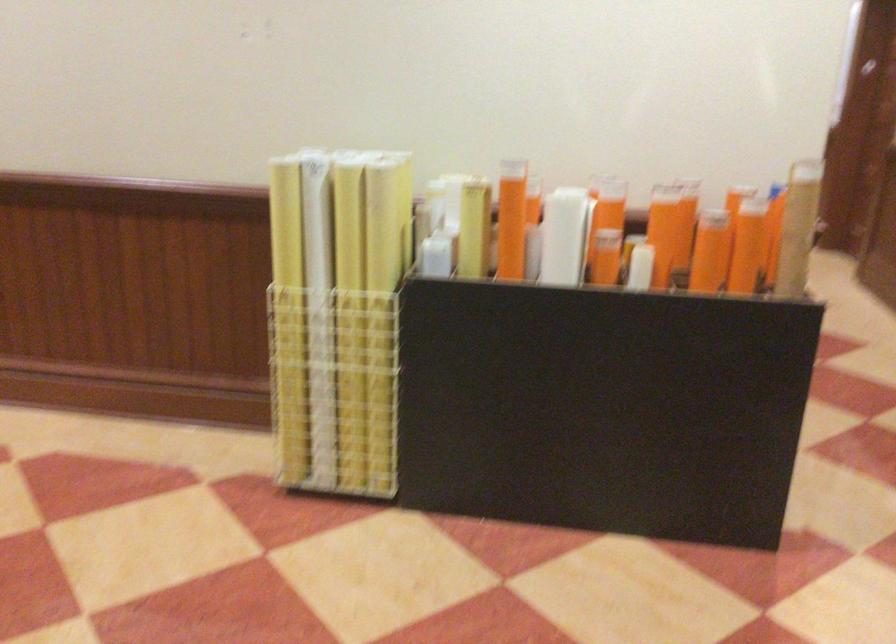
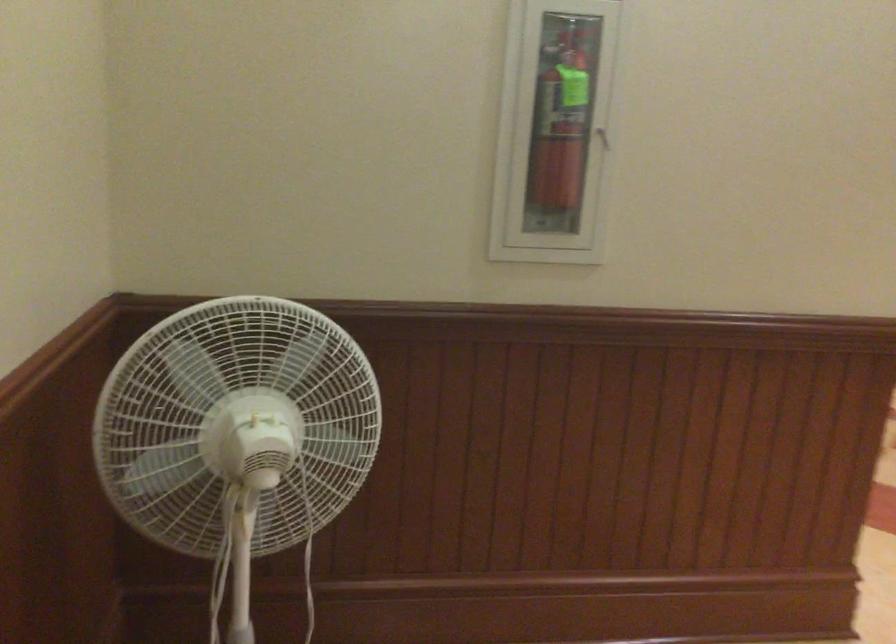
Question: The camera is either moving clockwise (left) or counter-clockwise (right) around the object. The first image is from the beginning of the video and the second image is from the end. Is the camera moving left or right when shooting the video?

Choices:
 (A) Left
 (B) Right

Answer: (B)